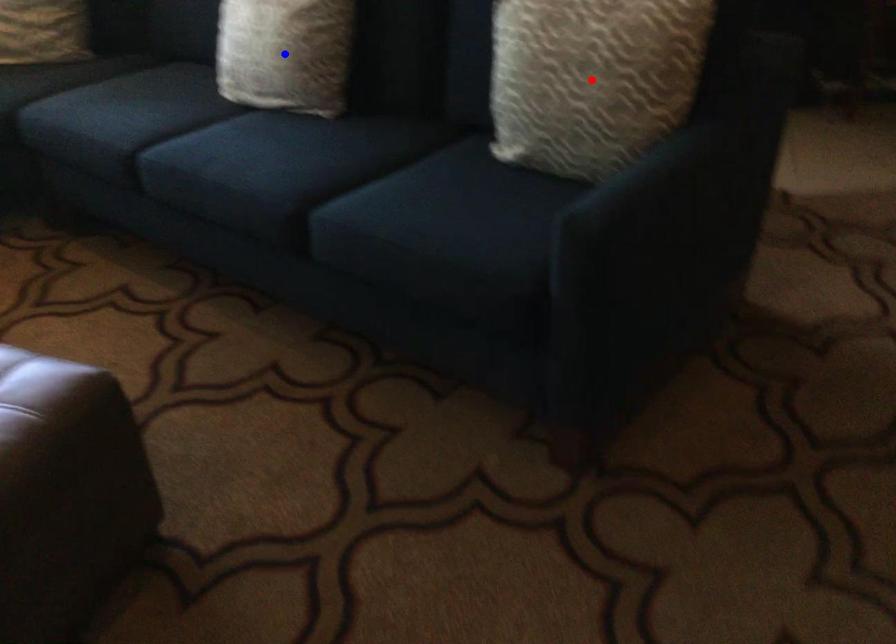
Question: Which of the two points in the image is closer to the camera?

Choices:
 (A) Blue point is closer.
 (B) Red point is closer.

Answer: (B)